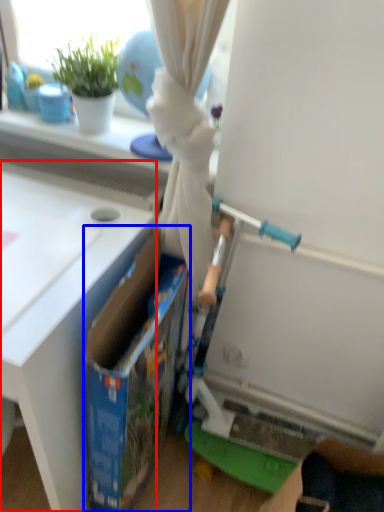
Question: Which of the following is the farthest to the observer, table (highlighted by a red box) or storage box (highlighted by a blue box)?

Choices:
 (A) table
 (B) storage box

Answer: (B)